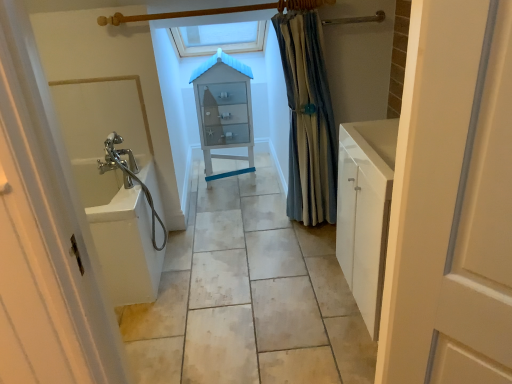
Question: Is blue striped fabric at right not within white glossy sink at left?

Choices:
 (A) yes
 (B) no

Answer: (A)

Question: Is blue striped fabric at right further to the viewer compared to white glossy sink at left?

Choices:
 (A) no
 (B) yes

Answer: (B)

Question: Can you confirm if blue striped fabric at right is thinner than white glossy sink at left?

Choices:
 (A) yes
 (B) no

Answer: (A)

Question: Can you confirm if blue striped fabric at right is shorter than white glossy sink at left?

Choices:
 (A) no
 (B) yes

Answer: (A)

Question: From a real-world perspective, is blue striped fabric at right located beneath white glossy sink at left?

Choices:
 (A) no
 (B) yes

Answer: (A)

Question: Is blue striped fabric at right surrounding white glossy sink at left?

Choices:
 (A) yes
 (B) no

Answer: (B)

Question: Is white matte door at right not inside translucent glass cabinet at center?

Choices:
 (A) no
 (B) yes

Answer: (B)

Question: From a real-world perspective, is white matte door at right physically above translucent glass cabinet at center?

Choices:
 (A) no
 (B) yes

Answer: (B)

Question: Can you confirm if white matte door at right is thinner than translucent glass cabinet at center?

Choices:
 (A) no
 (B) yes

Answer: (B)

Question: Can you confirm if white matte door at right is bigger than translucent glass cabinet at center?

Choices:
 (A) yes
 (B) no

Answer: (B)

Question: Considering the relative positions of white matte door at right and translucent glass cabinet at center in the image provided, is white matte door at right behind translucent glass cabinet at center?

Choices:
 (A) yes
 (B) no

Answer: (B)

Question: Is white matte door at right beside translucent glass cabinet at center?

Choices:
 (A) yes
 (B) no

Answer: (B)

Question: Is blue striped fabric at right inside translucent glass cabinet at center?

Choices:
 (A) no
 (B) yes

Answer: (A)